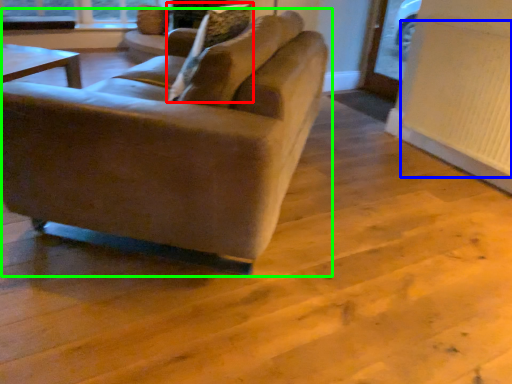
Question: Which object is positioned farthest from pillow (highlighted by a red box)? Select from radiator (highlighted by a blue box) and studio couch (highlighted by a green box).

Choices:
 (A) radiator
 (B) studio couch

Answer: (A)